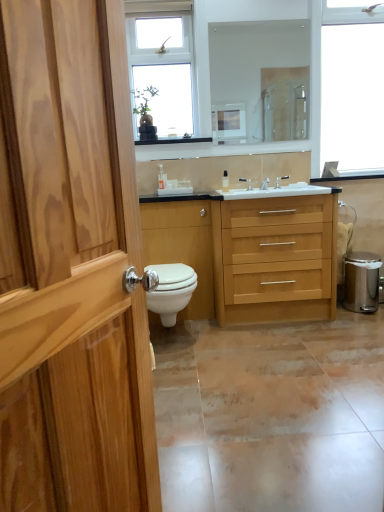
Question: Does silver metallic faucet at center, the first tap from the right, have a greater width compared to matte ceramic tile at lower center?

Choices:
 (A) yes
 (B) no

Answer: (B)

Question: From the image's perspective, is silver metallic faucet at center, acting as the third tap starting from the left, located beneath matte ceramic tile at lower center?

Choices:
 (A) yes
 (B) no

Answer: (B)

Question: Does silver metallic faucet at center, acting as the third tap starting from the left, have a larger size compared to matte ceramic tile at lower center?

Choices:
 (A) no
 (B) yes

Answer: (A)

Question: Is silver metallic faucet at center, acting as the third tap starting from the left, outside of matte ceramic tile at lower center?

Choices:
 (A) no
 (B) yes

Answer: (B)

Question: Is the depth of silver metallic faucet at center, the first tap from the right, greater than that of matte ceramic tile at lower center?

Choices:
 (A) no
 (B) yes

Answer: (B)

Question: From a real-world perspective, is silver metallic trash can at lower right physically located above or below clear plastic bottle at center, the 1th toiletry in the left-to-right sequence?

Choices:
 (A) below
 (B) above

Answer: (A)

Question: Based on their sizes in the image, would you say silver metallic trash can at lower right is bigger or smaller than clear plastic bottle at center, the 1th toiletry in the left-to-right sequence?

Choices:
 (A) small
 (B) big

Answer: (B)

Question: Is point (354, 307) closer or farther from the camera than point (160, 163)?

Choices:
 (A) closer
 (B) farther

Answer: (B)

Question: Based on their positions, is silver metallic trash can at lower right located to the left or right of clear plastic bottle at center, positioned as the second toiletry in right-to-left order?

Choices:
 (A) right
 (B) left

Answer: (A)

Question: Considering the relative positions of light wood/woodenobject at center and wooden drawer at center in the image provided, is light wood/woodenobject at center to the left or to the right of wooden drawer at center?

Choices:
 (A) left
 (B) right

Answer: (B)

Question: Does point (256, 202) appear closer or farther from the camera than point (304, 200)?

Choices:
 (A) farther
 (B) closer

Answer: (B)

Question: From the image's perspective, is light wood/woodenobject at center positioned above or below wooden drawer at center?

Choices:
 (A) below
 (B) above

Answer: (A)

Question: Choose the correct answer: Is light wood/woodenobject at center inside wooden drawer at center or outside it?

Choices:
 (A) outside
 (B) inside

Answer: (A)

Question: Considering their positions, is matte ceramic tile at lower center located in front of or behind clear glass mirror at upper center?

Choices:
 (A) behind
 (B) front

Answer: (B)

Question: Is matte ceramic tile at lower center taller or shorter than clear glass mirror at upper center?

Choices:
 (A) short
 (B) tall

Answer: (A)